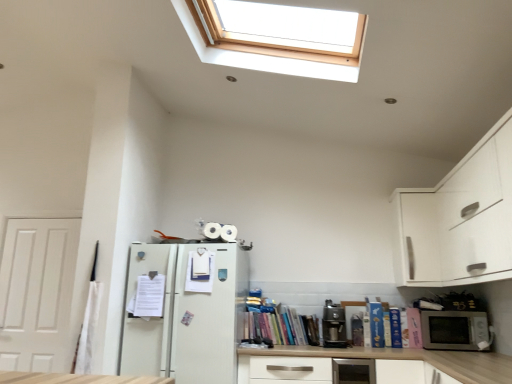
Where is `hardcover books at center, placed as the 5th book when sorted from right to left`? hardcover books at center, placed as the 5th book when sorted from right to left is located at coordinates (279, 326).

The height and width of the screenshot is (384, 512). Describe the element at coordinates (148, 296) in the screenshot. I see `white paper at left, the 1th book positioned from the left` at that location.

This screenshot has height=384, width=512. I want to click on hardcover book at right, positioned as the 1th book in right-to-left order, so click(x=414, y=327).

This screenshot has height=384, width=512. Describe the element at coordinates (290, 369) in the screenshot. I see `white matte drawer at center` at that location.

The height and width of the screenshot is (384, 512). Find the location of `white matte book at center, the second book viewed from the left`. white matte book at center, the second book viewed from the left is located at coordinates (200, 271).

Identify the location of the 3rd book counting from the left of the blue hardcover book at lower right, which appears as the second book when viewed from the right. (279, 326).

Which of these two, hardcover books at center, placed as the 5th book when sorted from right to left, or blue hardcover book at lower right, the 6th book from the left, is smaller?

With smaller size is blue hardcover book at lower right, the 6th book from the left.

Is hardcover books at center, placed as the 5th book when sorted from right to left, positioned beyond the bounds of blue hardcover book at lower right, which appears as the second book when viewed from the right?

hardcover books at center, placed as the 5th book when sorted from right to left, is positioned outside blue hardcover book at lower right, which appears as the second book when viewed from the right.

Could you tell me if satin silver coffee machine at lower center is turned towards blue hardcover book at lower right, placed as the 5th book when sorted from left to right?

No, satin silver coffee machine at lower center does not turn towards blue hardcover book at lower right, placed as the 5th book when sorted from left to right.

Does point (337, 345) appear closer or farther from the camera than point (393, 314)?

Point (337, 345).

Is satin silver coffee machine at lower center to the left of blue hardcover book at lower right, the third book in the right-to-left sequence, from the viewer's perspective?

Yes.

Considering the sizes of objects satin silver coffee machine at lower center and blue hardcover book at lower right, the third book in the right-to-left sequence, in the image provided, who is thinner, satin silver coffee machine at lower center or blue hardcover book at lower right, the third book in the right-to-left sequence,?

With smaller width is blue hardcover book at lower right, the third book in the right-to-left sequence.

Considering the points (338, 347) and (346, 383), which point is behind, point (338, 347) or point (346, 383)?

Point (338, 347)

Does satin silver coffee machine at lower center have a greater width compared to satin silver toaster at lower center?

Incorrect, the width of satin silver coffee machine at lower center does not surpass that of satin silver toaster at lower center.

Which is behind, satin silver coffee machine at lower center or satin silver toaster at lower center?

satin silver coffee machine at lower center is further from the camera.

Would you say satin silver coffee machine at lower center is outside satin silver toaster at lower center?

Yes, satin silver coffee machine at lower center is located beyond the bounds of satin silver toaster at lower center.

Is hardcover books at center, placed as the 5th book when sorted from right to left, located outside white matte drawer at center?

Yes, hardcover books at center, placed as the 5th book when sorted from right to left, is located beyond the bounds of white matte drawer at center.

Is hardcover books at center, placed as the 5th book when sorted from right to left, further to the viewer compared to white matte drawer at center?

Yes, hardcover books at center, placed as the 5th book when sorted from right to left, is further from the viewer.

Consider the image. Is white matte drawer at center at the back of hardcover books at center, placed as the 5th book when sorted from right to left?

No, hardcover books at center, placed as the 5th book when sorted from right to left, is not facing away from white matte drawer at center.

Is hardcover books at center, which ranks as the 3th book in left-to-right order, at the right side of white matte drawer at center?

No.

Considering the relative sizes of silver metallic microwave at lower right and blue hardcover book at lower right, the 6th book from the left, in the image provided, is silver metallic microwave at lower right bigger than blue hardcover book at lower right, the 6th book from the left,?

Correct, silver metallic microwave at lower right is larger in size than blue hardcover book at lower right, the 6th book from the left.

Is silver metallic microwave at lower right next to blue hardcover book at lower right, which appears as the second book when viewed from the right?

silver metallic microwave at lower right and blue hardcover book at lower right, which appears as the second book when viewed from the right, are clearly separated.

Based on the photo, which of these two, silver metallic microwave at lower right or blue hardcover book at lower right, the 6th book from the left, stands shorter?

With less height is silver metallic microwave at lower right.

From the image's perspective, is silver metallic microwave at lower right on blue hardcover book at lower right, which appears as the second book when viewed from the right?

Correct, silver metallic microwave at lower right appears higher than blue hardcover book at lower right, which appears as the second book when viewed from the right, in the image.

Can you confirm if satin silver coffee machine at lower center is positioned to the left of blue matte book at lower right, which ranks as the fourth book in left-to-right order?

Yes.

Who is bigger, satin silver coffee machine at lower center or blue matte book at lower right, which ranks as the fourth book in left-to-right order?

Bigger between the two is satin silver coffee machine at lower center.

Which is farther, [341,324] or [373,326]?

The point [341,324] is more distant.

Does white matte drawer at center turn towards satin silver coffee machine at lower center?

No.

Choose the correct answer: Is white matte drawer at center inside satin silver coffee machine at lower center or outside it?

white matte drawer at center is located beyond the bounds of satin silver coffee machine at lower center.

Considering the relative sizes of white matte drawer at center and satin silver coffee machine at lower center in the image provided, is white matte drawer at center smaller than satin silver coffee machine at lower center?

No.

Looking at their sizes, would you say white matte drawer at center is wider or thinner than satin silver coffee machine at lower center?

white matte drawer at center is wider than satin silver coffee machine at lower center.

The height and width of the screenshot is (384, 512). I want to click on the 3rd book counting from the right side of the hardcover books at center, placed as the 5th book when sorted from right to left, so point(404,328).

The width and height of the screenshot is (512, 384). What are the coordinates of `the 3rd book behind the satin silver coffee machine at lower center, starting your count from the anchor` in the screenshot? It's located at (395, 328).

From the picture: Based on their spatial positions, is white matte door at left or white matte drawer at center closer to blue hardcover book at lower right, the third book in the right-to-left sequence?

The object closer to blue hardcover book at lower right, the third book in the right-to-left sequence, is white matte drawer at center.

Which object lies nearer to the anchor point silver metallic microwave at lower right, blue hardcover book at lower right, which appears as the second book when viewed from the right, or satin silver toaster at lower center?

blue hardcover book at lower right, which appears as the second book when viewed from the right, is closer to silver metallic microwave at lower right.

Estimate the real-world distances between objects in this image. Which object is further from hardcover books at center, which ranks as the 3th book in left-to-right order, white matte book at center, the 6th book viewed from the right, or white matte door at left?

Among the two, white matte door at left is located further to hardcover books at center, which ranks as the 3th book in left-to-right order.

Based on their spatial positions, is blue matte book at lower right, which ranks as the fourth book in left-to-right order, or white matte book at center, the 6th book viewed from the right, closer to satin silver toaster at lower center?

blue matte book at lower right, which ranks as the fourth book in left-to-right order, is positioned closer to the anchor satin silver toaster at lower center.

Looking at the image, which one is located further to blue matte book at lower right, which is the 4th book from right to left, white paper at left, the 7th book when ordered from right to left, or hardcover book at right, arranged as the 7th book when viewed from the left?

The object further to blue matte book at lower right, which is the 4th book from right to left, is white paper at left, the 7th book when ordered from right to left.

From the image, which object appears to be nearer to blue hardcover book at lower right, the 6th book from the left, white matte door at left or white matte book at center, the 6th book viewed from the right?

white matte book at center, the 6th book viewed from the right, is closer to blue hardcover book at lower right, the 6th book from the left.

Estimate the real-world distances between objects in this image. Which object is further from silver metallic microwave at lower right, satin silver toaster at lower center or white matte door at left?

white matte door at left.

Estimate the real-world distances between objects in this image. Which object is closer to satin silver toaster at lower center, silver metallic microwave at lower right or satin silver coffee machine at lower center?

Based on the image, satin silver coffee machine at lower center appears to be nearer to satin silver toaster at lower center.

Where is `appliance between white matte book at center, the second book viewed from the left, and blue hardcover book at lower right, which appears as the second book when viewed from the right, in the horizontal direction`? The height and width of the screenshot is (384, 512). appliance between white matte book at center, the second book viewed from the left, and blue hardcover book at lower right, which appears as the second book when viewed from the right, in the horizontal direction is located at coordinates (353, 371).

At what (x,y) coordinates should I click in order to perform the action: click on drawer situated between hardcover books at center, placed as the 5th book when sorted from right to left, and silver metallic microwave at lower right from left to right. Please return your answer as a coordinate pair (x, y). Looking at the image, I should click on (290, 369).

The width and height of the screenshot is (512, 384). What are the coordinates of `drawer between white paper at left, the 1th book positioned from the left, and blue hardcover book at lower right, the third book in the right-to-left sequence, in the horizontal direction` in the screenshot? It's located at (290, 369).

At what (x,y) coordinates should I click in order to perform the action: click on appliance situated between white matte door at left and blue hardcover book at lower right, which appears as the second book when viewed from the right, from left to right. Please return your answer as a coordinate pair (x, y). The width and height of the screenshot is (512, 384). Looking at the image, I should click on (353, 371).